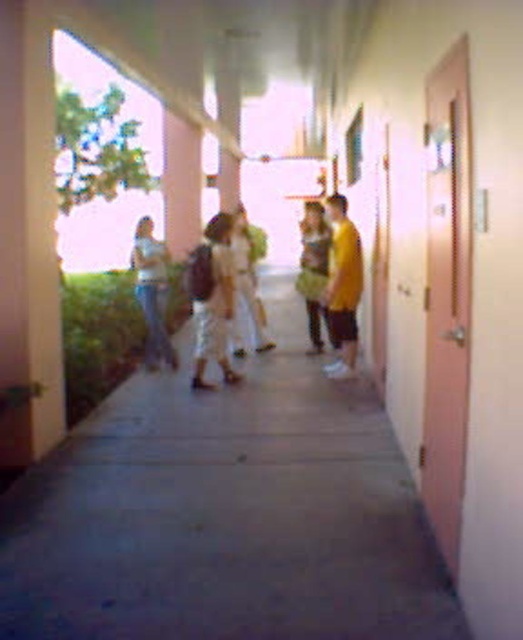
Question: Is matte brown backpack at center further to camera compared to denim jeans at left?

Choices:
 (A) no
 (B) yes

Answer: (A)

Question: Which point is farther from the camera taking this photo?

Choices:
 (A) (230, 310)
 (B) (157, 324)

Answer: (B)

Question: Can you confirm if matte brown backpack at center is positioned below denim jeans at left?

Choices:
 (A) yes
 (B) no

Answer: (A)

Question: Can you confirm if matte brown backpack at center is smaller than denim jeans at left?

Choices:
 (A) no
 (B) yes

Answer: (B)